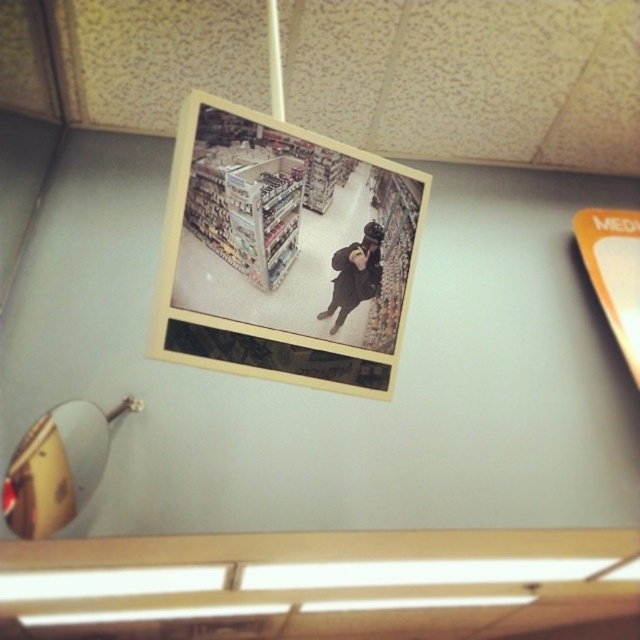
Question: Is gold metallic lamp at lower left bigger than matte black jacket at center?

Choices:
 (A) yes
 (B) no

Answer: (A)

Question: Which of the following is the farthest from the observer?

Choices:
 (A) (x=291, y=189)
 (B) (x=58, y=420)
 (C) (x=355, y=269)

Answer: (B)

Question: Is yellow matte photo frame at center wider than gold metallic lamp at lower left?

Choices:
 (A) yes
 (B) no

Answer: (A)

Question: Does yellow matte photo frame at center have a greater width compared to matte black jacket at center?

Choices:
 (A) yes
 (B) no

Answer: (A)

Question: Which object is closer to the camera taking this photo?

Choices:
 (A) yellow matte photo frame at center
 (B) gold metallic lamp at lower left
 (C) matte black jacket at center

Answer: (A)

Question: Among these points, which one is farthest from the camera?

Choices:
 (A) (209, 134)
 (B) (35, 436)
 (C) (381, 230)

Answer: (B)